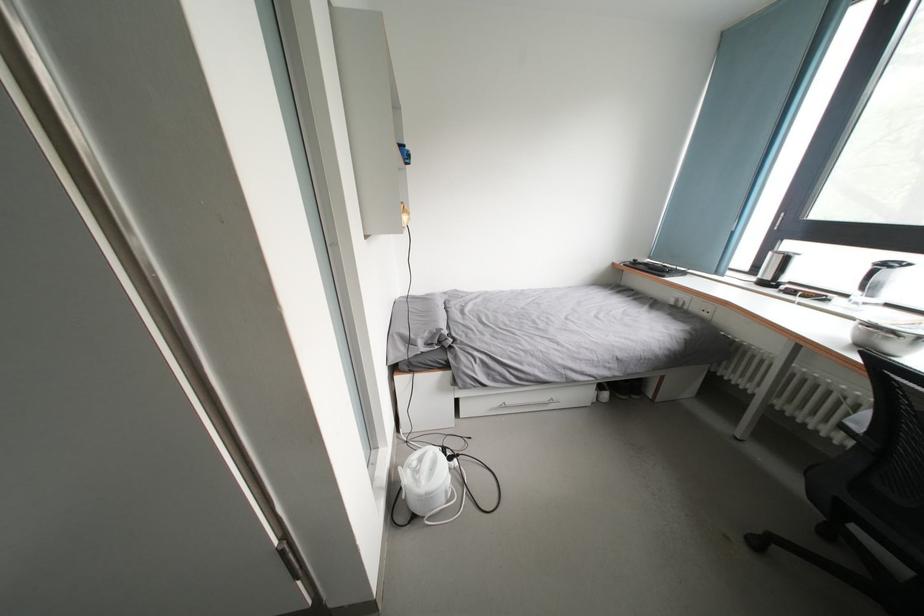
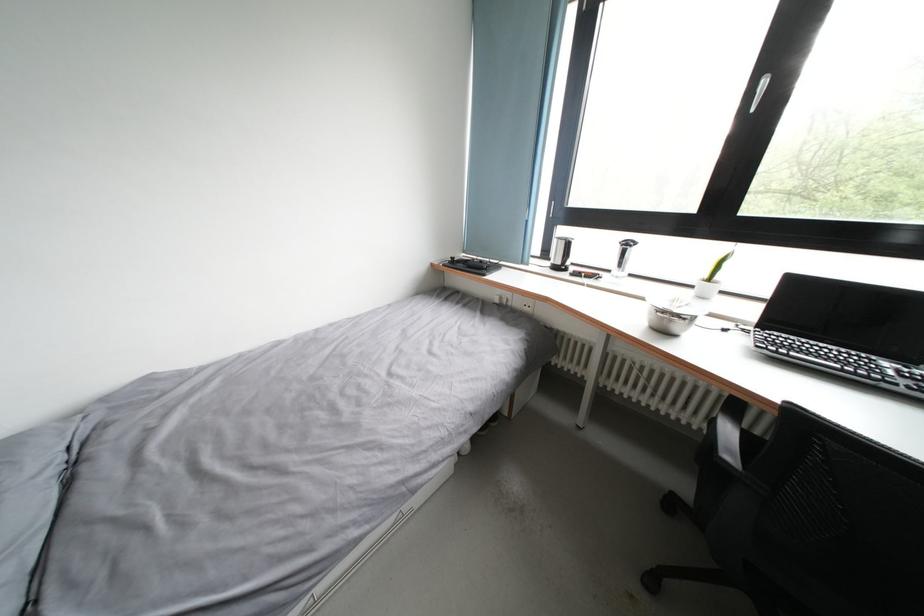
In the second image, find the point that corresponds to pixel 761 275 in the first image.

(552, 259)